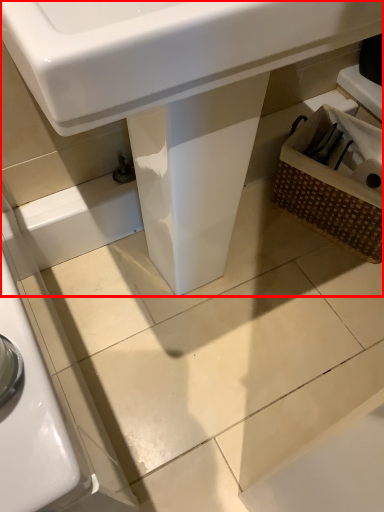
Question: Considering the relative positions of sink (annotated by the red box) and basket in the image provided, where is sink (annotated by the red box) located with respect to the staircase?

Choices:
 (A) right
 (B) left

Answer: (B)